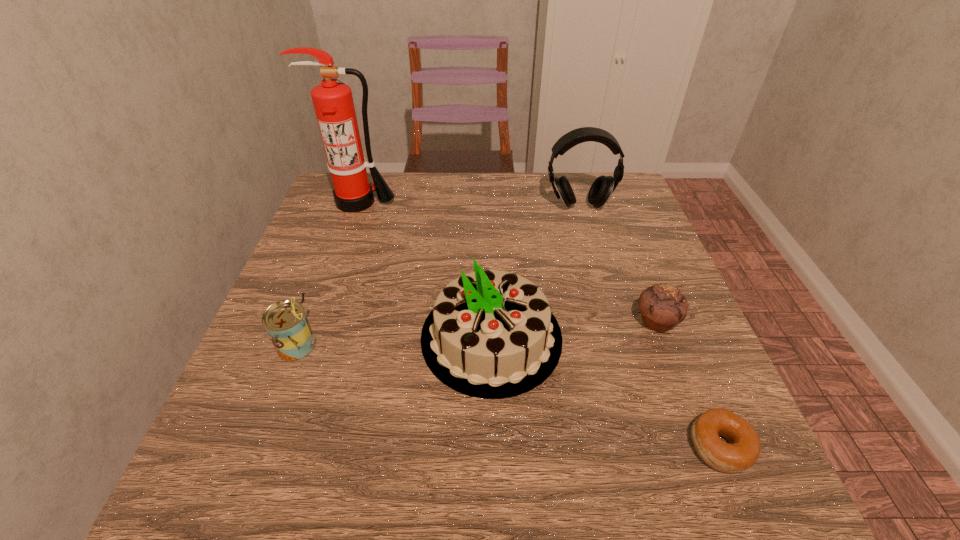
Locate an element on the screen. The width and height of the screenshot is (960, 540). vacant region located on the right of the third tallest object is located at coordinates (644, 338).

You are a GUI agent. You are given a task and a screenshot of the screen. Output one action in this format:
    pyautogui.click(x=<x>, y=<y>)
    Task: Click on the vacant space located on the back of the third shortest object
    The width and height of the screenshot is (960, 540).
    Given the screenshot: What is the action you would take?
    pyautogui.click(x=348, y=213)

The height and width of the screenshot is (540, 960). In order to click on free region located 0.070m on the left of the fifth tallest object in this screenshot , I will do `click(599, 321)`.

Locate an element on the screen. The image size is (960, 540). vacant space located 0.330m on the left of the bagel is located at coordinates (480, 446).

The height and width of the screenshot is (540, 960). I want to click on fire extinguisher present at the far edge, so click(333, 102).

The image size is (960, 540). I want to click on earphone at the far edge, so click(x=602, y=188).

This screenshot has width=960, height=540. Identify the location of object at the near edge. (742, 451).

This screenshot has width=960, height=540. What are the coordinates of `fire extinguisher that is at the left edge` in the screenshot? It's located at (333, 102).

What are the coordinates of `can present at the left edge` in the screenshot? It's located at (286, 323).

Find the location of a particular element. This screenshot has width=960, height=540. earphone at the right edge is located at coordinates (602, 188).